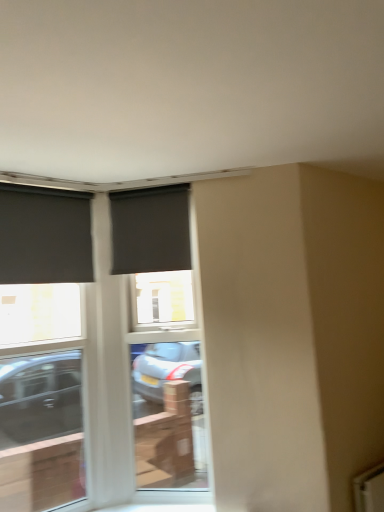
Question: Is matte black roller blind at left, which is counted as the first window, starting from the left, wider or thinner than matte black screen door at center?

Choices:
 (A) thin
 (B) wide

Answer: (A)

Question: From their relative heights in the image, would you say matte black roller blind at left, which ranks as the third window in right-to-left order, is taller or shorter than matte black screen door at center?

Choices:
 (A) short
 (B) tall

Answer: (A)

Question: Which is nearer to the matte black screen door at center?

Choices:
 (A) matte black window at left, placed as the 2th window when sorted from right to left
 (B) matte black roller blind at left, which is counted as the first window, starting from the left
 (C) matte black roller blind at center, which is the 1th window from right to left

Answer: (A)

Question: Which of these objects is positioned farthest from the matte black roller blind at left, which is counted as the first window, starting from the left?

Choices:
 (A) matte black window at left, which appears as the 2th window when viewed from the left
 (B) matte black roller blind at center, arranged as the 3th window when viewed from the left
 (C) matte black screen door at center

Answer: (A)